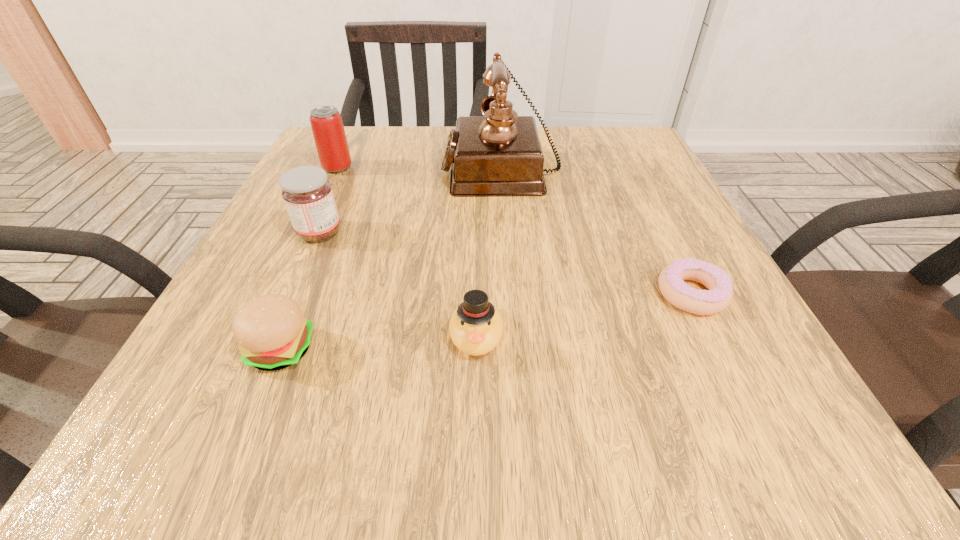
The image size is (960, 540). I want to click on object situated at the right edge, so click(x=671, y=279).

Find the location of `object that is at the far left corner`. object that is at the far left corner is located at coordinates (327, 126).

The image size is (960, 540). In the image, there is a desktop. Identify the location of vacant space at the far edge. (383, 157).

In the image, there is a desktop. Identify the location of vacant area at the left edge. The height and width of the screenshot is (540, 960). (224, 310).

Where is `vacant space at the right edge of the desktop`? This screenshot has height=540, width=960. vacant space at the right edge of the desktop is located at coordinates (676, 193).

Find the location of a particular element. blank space at the far left corner of the desktop is located at coordinates (361, 153).

Identify the location of vacant region at the near left corner of the desktop. This screenshot has width=960, height=540. (250, 424).

In the image, there is a desktop. Where is `vacant space at the far right corner`? This screenshot has height=540, width=960. vacant space at the far right corner is located at coordinates (587, 130).

Find the location of a particular element. The image size is (960, 540). vacant space at the near right corner of the desktop is located at coordinates (687, 445).

You are a GUI agent. You are given a task and a screenshot of the screen. Output one action in this format:
    pyautogui.click(x=<x>, y=<y>)
    Task: Click on the vacant space that is in between the jam and the telephone
    
    Given the screenshot: What is the action you would take?
    pyautogui.click(x=410, y=200)